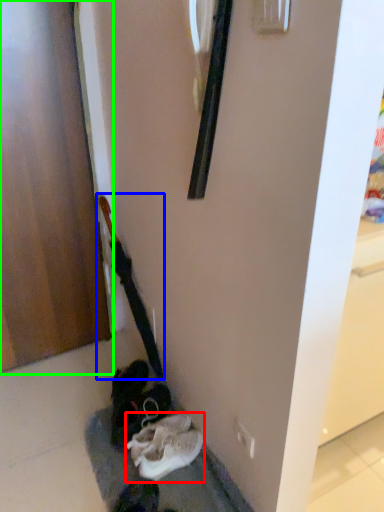
Question: Based on their relative distances, which object is nearer to footwear (highlighted by a red box)? Choose from guitar (highlighted by a blue box) and door (highlighted by a green box).

Choices:
 (A) guitar
 (B) door

Answer: (A)